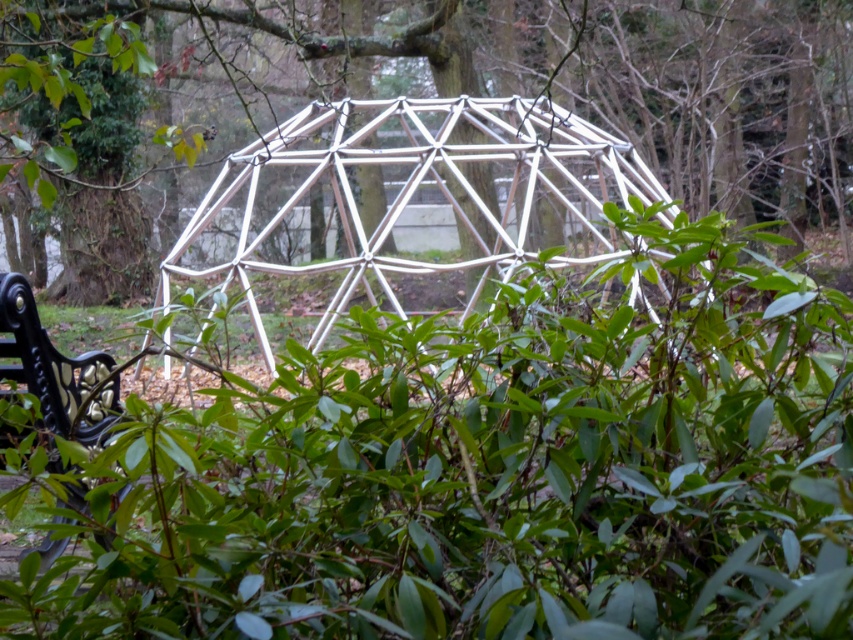
Does green matte bush at center appear on the left side of green leafy tree at center?

Yes, green matte bush at center is to the left of green leafy tree at center.

Looking at this image, does green matte bush at center have a lesser width compared to green leafy tree at center?

Indeed, green matte bush at center has a lesser width compared to green leafy tree at center.

Is point (834, 600) farther from camera compared to point (650, 60)?

That is False.

This screenshot has width=853, height=640. I want to click on green matte bush at center, so tap(497, 474).

Which of these two, green leafy tree at center or white metallic geodesic dome at center, stands taller?

green leafy tree at center

Looking at this image, who is positioned more to the left, green leafy tree at center or white metallic geodesic dome at center?

Positioned to the left is white metallic geodesic dome at center.

Which is in front, point (701, 102) or point (602, 179)?

Point (602, 179) is more forward.

The height and width of the screenshot is (640, 853). Identify the location of green leafy tree at center. (630, 83).

Who is taller, green matte bush at center or white metallic geodesic dome at center?

white metallic geodesic dome at center

Does green matte bush at center have a lesser height compared to white metallic geodesic dome at center?

Yes.

Consider the image. Who is more forward, (589,573) or (442,150)?

Point (589,573) is more forward.

Image resolution: width=853 pixels, height=640 pixels. I want to click on green matte bush at center, so click(497, 474).